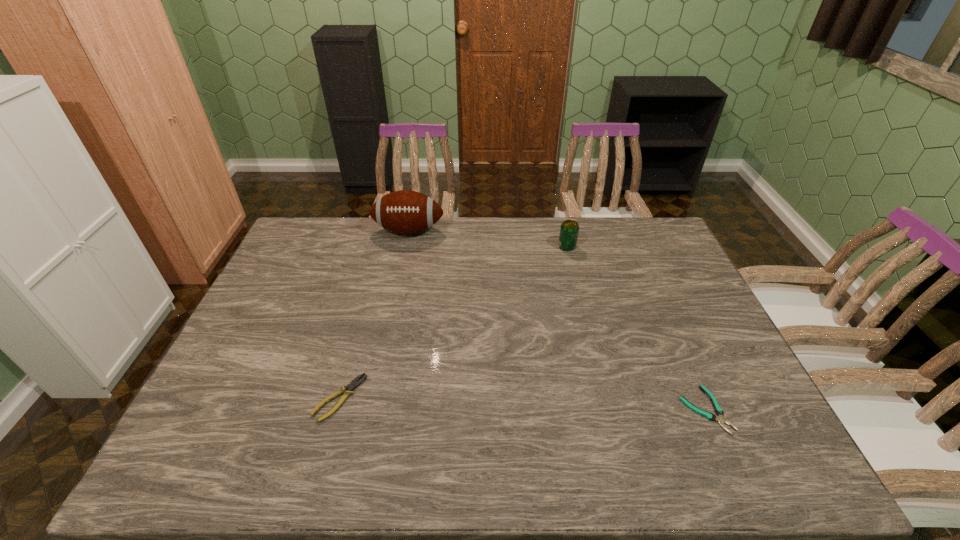
Where is `the tallest object`? The image size is (960, 540). the tallest object is located at coordinates (406, 212).

You are a GUI agent. You are given a task and a screenshot of the screen. Output one action in this format:
    pyautogui.click(x=<x>, y=<y>)
    Task: Click on the second object from right to left
    Image resolution: width=960 pixels, height=540 pixels.
    Given the screenshot: What is the action you would take?
    pyautogui.click(x=569, y=229)

Identify the location of the third shortest object. This screenshot has height=540, width=960. (569, 229).

Find the location of a particular element. the left pliers is located at coordinates (348, 390).

Where is `the taller pliers`? Image resolution: width=960 pixels, height=540 pixels. the taller pliers is located at coordinates (348, 390).

Locate an element on the screen. This screenshot has height=540, width=960. the right pliers is located at coordinates (720, 418).

Locate an element on the screen. The width and height of the screenshot is (960, 540). the rightmost object is located at coordinates (720, 418).

Locate an element on the screen. The image size is (960, 540). free location located on the laces of the football is located at coordinates (404, 252).

At what (x,y) coordinates should I click in order to perform the action: click on vacant space situated on the front of the third object from left to right. Please return your answer as a coordinate pair (x, y). This screenshot has width=960, height=540. Looking at the image, I should click on (573, 271).

This screenshot has width=960, height=540. I want to click on free region located on the right of the third tallest object, so click(x=496, y=398).